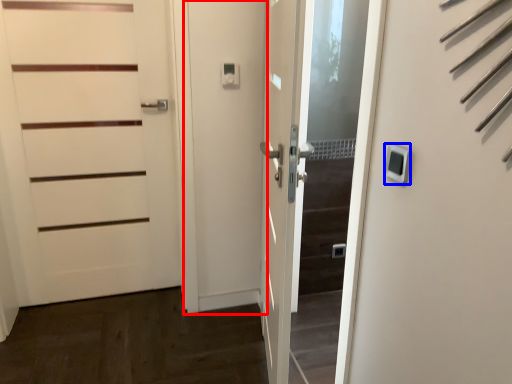
Question: Which object is further to the camera taking this photo, screen door (highlighted by a red box) or thermostat (highlighted by a blue box)?

Choices:
 (A) screen door
 (B) thermostat

Answer: (A)